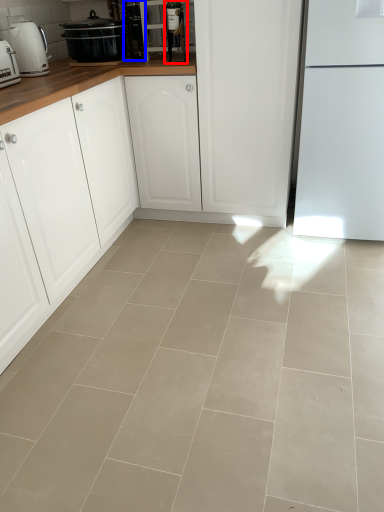
Question: Which of the following is the closest to the observer, appliance (highlighted by a red box) or appliance (highlighted by a blue box)?

Choices:
 (A) appliance
 (B) appliance

Answer: (A)